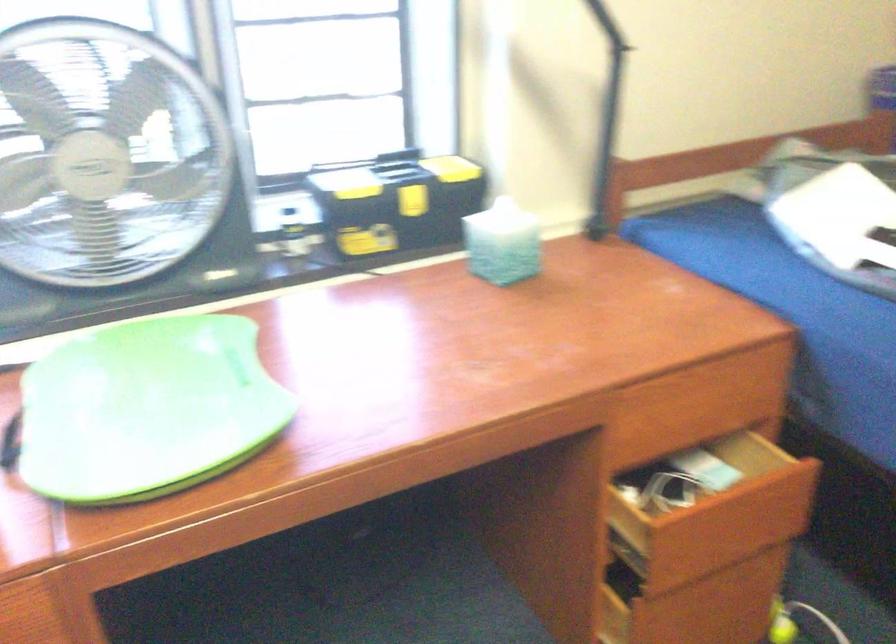
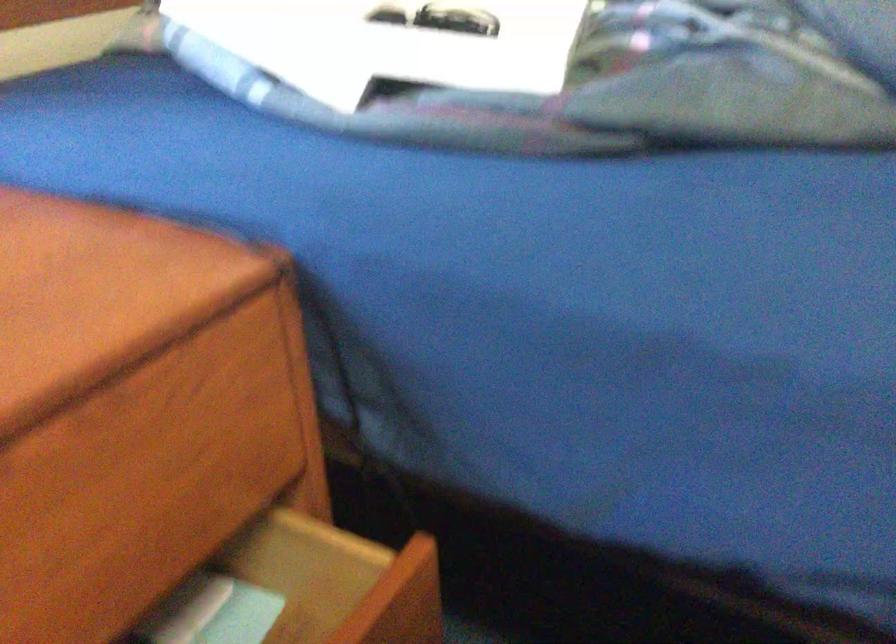
Question: The camera is either moving clockwise (left) or counter-clockwise (right) around the object. The first image is from the beginning of the video and the second image is from the end. Is the camera moving left or right when shooting the video?

Choices:
 (A) Left
 (B) Right

Answer: (A)